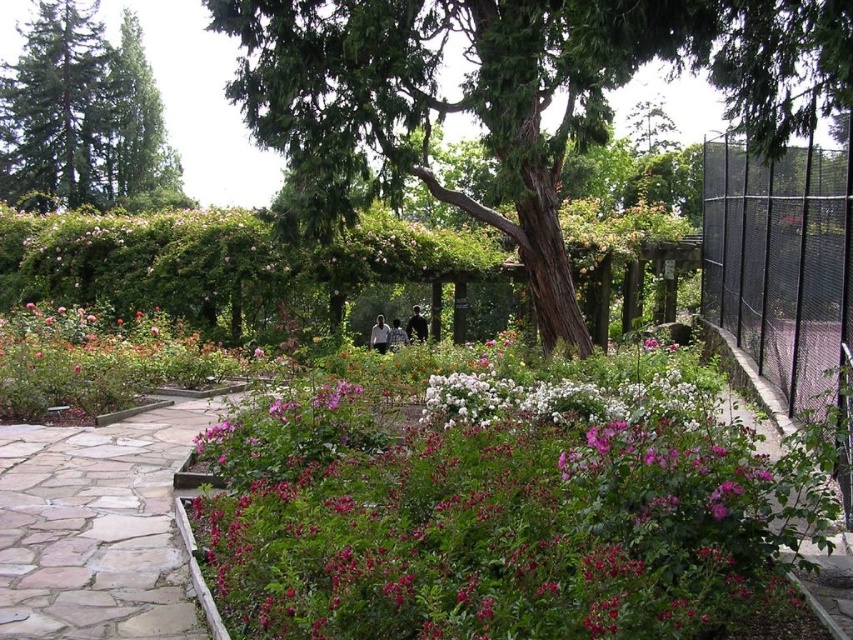
Based on the photo, you are a gardener standing at the entrance of the garden. You need to water both the green rough bark tree at center and the green glossy tree at upper left. Which tree should you water first if you want to minimize the distance you walk?

You should water the green rough bark tree at center first because it is closer to the entrance than the green glossy tree at upper left, which is 100.80 feet away from it.

You are standing at the point marked as point (508,97) in the garden. What do you see directly in front of you?

You see a green rough bark tree at center directly in front of you at point (508,97).

You are a landscape architect designing a new garden layout. You need to place a new sculpture that requires a 3x3 meter space. Given the current arrangement of the pink matte flowers at center and the green rough bark tree at center, which object would you consider relocating to accommodate the sculpture?

The pink matte flowers at center occupies less space than the green rough bark tree at center, so relocating the pink matte flowers at center would be easier to create the required space for the sculpture.